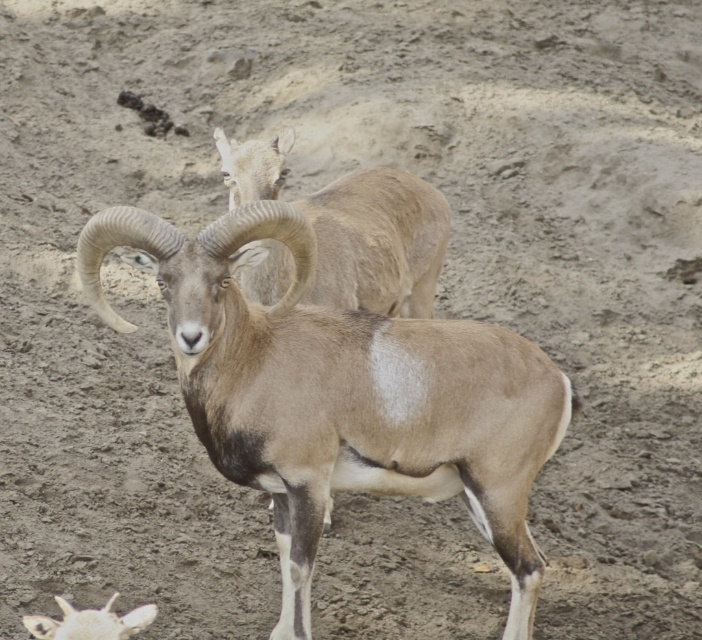
Between brown woolen goat at center and light brown woolen goat at upper center, which one appears on the right side from the viewer's perspective?

Positioned to the right is light brown woolen goat at upper center.

Between brown woolen goat at center and light brown woolen goat at upper center, which one is positioned higher?

Positioned higher is light brown woolen goat at upper center.

At what (x,y) coordinates should I click in order to perform the action: click on brown woolen goat at center. Please return your answer as a coordinate pair (x, y). The height and width of the screenshot is (640, 702). Looking at the image, I should click on (343, 396).

Is light brown woolen goat at upper center closer to the viewer compared to white woolen sheep at lower left?

No, it is behind white woolen sheep at lower left.

Between light brown woolen goat at upper center and white woolen sheep at lower left, which one appears on the left side from the viewer's perspective?

From the viewer's perspective, white woolen sheep at lower left appears more on the left side.

Is point (369, 204) behind point (44, 628)?

Yes, point (369, 204) is farther from viewer.

The image size is (702, 640). Identify the location of light brown woolen goat at upper center. (377, 243).

Looking at this image, is brown woolen goat at center thinner than white woolen sheep at lower left?

No.

Is brown woolen goat at center below white woolen sheep at lower left?

Actually, brown woolen goat at center is above white woolen sheep at lower left.

What are the coordinates of `brown woolen goat at center` in the screenshot? It's located at (343, 396).

Image resolution: width=702 pixels, height=640 pixels. Identify the location of brown woolen goat at center. (343, 396).